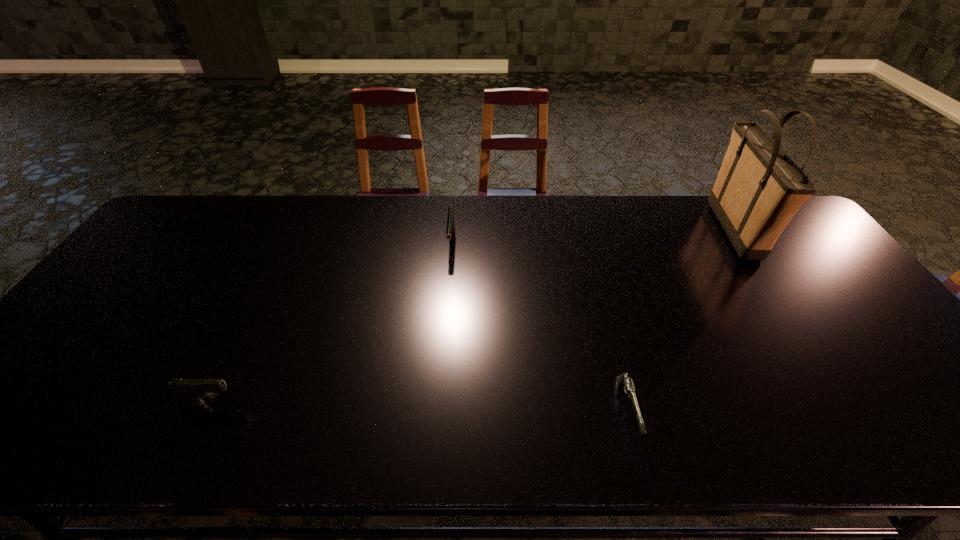
You are a GUI agent. You are given a task and a screenshot of the screen. Output one action in this format:
    pyautogui.click(x=<x>, y=<y>)
    Task: Click on the shopping bag located in the far edge section of the desktop
    The width and height of the screenshot is (960, 540).
    Given the screenshot: What is the action you would take?
    tap(759, 188)

This screenshot has width=960, height=540. What are the coordinates of `pistol that is at the far edge` in the screenshot? It's located at (450, 229).

You are a GUI agent. You are given a task and a screenshot of the screen. Output one action in this format:
    pyautogui.click(x=<x>, y=<y>)
    Task: Click on the object at the near edge
    
    Given the screenshot: What is the action you would take?
    pyautogui.click(x=625, y=380)

Locate an element on the screen. Image resolution: width=960 pixels, height=540 pixels. free space at the far edge of the desktop is located at coordinates (654, 207).

Where is `free space at the near edge of the desktop`? The width and height of the screenshot is (960, 540). free space at the near edge of the desktop is located at coordinates (449, 453).

Locate an element on the screen. Image resolution: width=960 pixels, height=540 pixels. vacant space at the left edge of the desktop is located at coordinates (102, 334).

Where is `vacant space at the right edge of the desktop`? Image resolution: width=960 pixels, height=540 pixels. vacant space at the right edge of the desktop is located at coordinates (862, 379).

Where is `vacant region at the far right corner of the desktop`? vacant region at the far right corner of the desktop is located at coordinates (788, 228).

Identify the location of free space between the second object from left to right and the rightmost object. (592, 237).

This screenshot has height=540, width=960. I want to click on free space between the second pistol from right to left and the leftmost pistol, so click(331, 323).